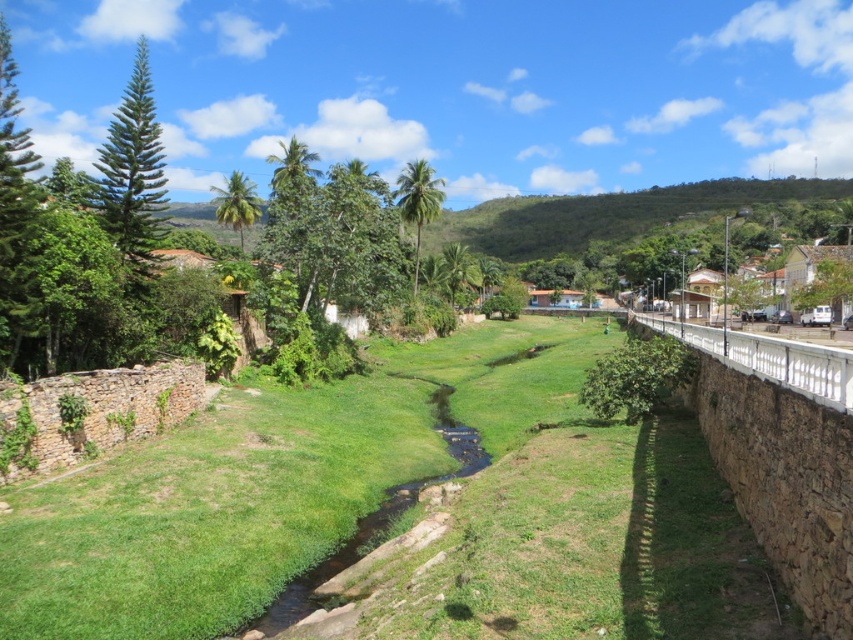
Consider the image. Which is more to the left, green grassy at center or green grassy creek at center?

green grassy at center is more to the left.

Consider the image. Can you confirm if green grassy at center is positioned above green grassy creek at center?

Yes.

Identify the location of green grassy at center. (384, 496).

At what (x,y) coordinates should I click in order to perform the action: click on green grassy at center. Please return your answer as a coordinate pair (x, y). The height and width of the screenshot is (640, 853). Looking at the image, I should click on (384, 496).